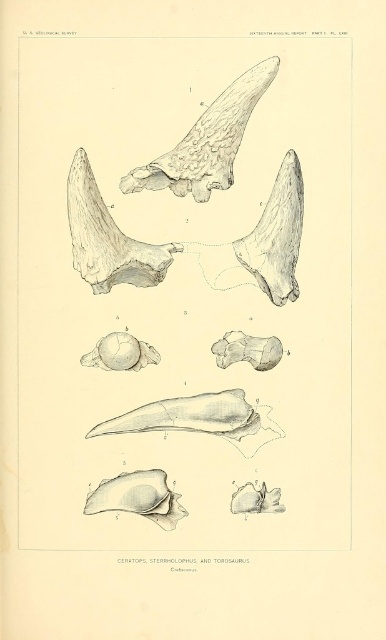
Question: Is gray matte bone at center bigger than matte gray skull at center-left?

Choices:
 (A) yes
 (B) no

Answer: (A)

Question: Can you confirm if gray textured bone at center is wider than smooth gray bone at lower left?

Choices:
 (A) no
 (B) yes

Answer: (B)

Question: Which object is the closest to the matte gray skull at center-left?

Choices:
 (A) smooth gray skull at lower right
 (B) smooth gray bone at lower left
 (C) gray matte bone at center
 (D) gray textured bone at center

Answer: (C)

Question: Is smooth gray bone at lower left smaller than smooth gray skull at lower right?

Choices:
 (A) yes
 (B) no

Answer: (B)

Question: Which point is closer to the camera?

Choices:
 (A) matte gray skull at center-left
 (B) smooth gray skull at lower right
 (C) gray textured bone at center

Answer: (C)

Question: Which of the following is the closest to the observer?

Choices:
 (A) (84, 358)
 (B) (101, 509)
 (C) (235, 397)

Answer: (B)